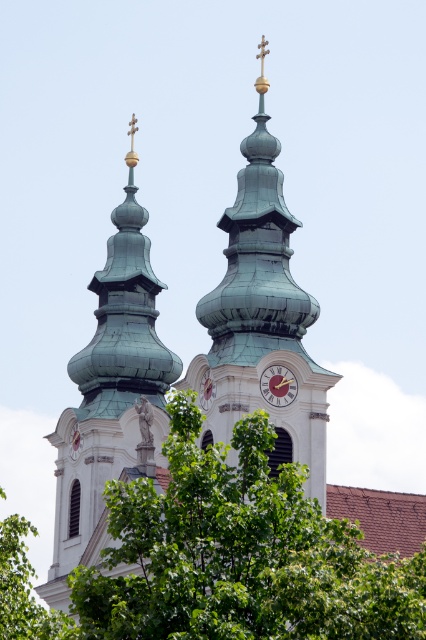
Consider the image. Which is more to the left, green copper tower at left or green leafy tree at lower left?

Positioned to the left is green leafy tree at lower left.

Who is more forward, (94, 337) or (26, 632)?

Point (26, 632)

At what (x,y) coordinates should I click in order to perform the action: click on green copper tower at left. Please return your answer as a coordinate pair (x, y). Looking at the image, I should click on (109, 394).

What are the coordinates of `green copper tower at left` in the screenshot? It's located at (109, 394).

Is green copper tower at left positioned at the back of wooden clock face at center?

No, it is not.

Is point (152, 340) closer to camera compared to point (273, 381)?

That is False.

The width and height of the screenshot is (426, 640). I want to click on green copper tower at left, so pyautogui.click(x=109, y=394).

Where is `green copper tower at left`? The height and width of the screenshot is (640, 426). green copper tower at left is located at coordinates (109, 394).

Is green leafy tree at center in front of green copper clock tower at center?

Yes.

Does green leafy tree at center appear over green copper clock tower at center?

No, green leafy tree at center is not above green copper clock tower at center.

Between point (117, 632) and point (213, 371), which one is positioned in front?

Point (117, 632) is more forward.

Where is `green leafy tree at center`? The height and width of the screenshot is (640, 426). green leafy tree at center is located at coordinates (238, 554).